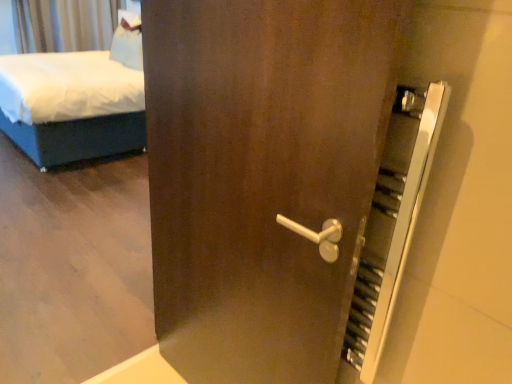
Question: Does silky gray curtain at upper left have a greater width compared to white fabric bed at left?

Choices:
 (A) yes
 (B) no

Answer: (B)

Question: Can you confirm if silky gray curtain at upper left is bigger than white fabric bed at left?

Choices:
 (A) yes
 (B) no

Answer: (B)

Question: Is the position of silky gray curtain at upper left less distant than that of white fabric bed at left?

Choices:
 (A) no
 (B) yes

Answer: (A)

Question: Is silky gray curtain at upper left at the left side of white fabric bed at left?

Choices:
 (A) yes
 (B) no

Answer: (A)

Question: Considering the relative sizes of silky gray curtain at upper left and white fabric bed at left in the image provided, is silky gray curtain at upper left thinner than white fabric bed at left?

Choices:
 (A) yes
 (B) no

Answer: (A)

Question: Is silky gray curtain at upper left positioned behind white fabric bed at left?

Choices:
 (A) no
 (B) yes

Answer: (B)

Question: Does white fabric bed at left have a smaller size compared to silky gray curtain at upper left?

Choices:
 (A) yes
 (B) no

Answer: (B)

Question: From a real-world perspective, is white fabric bed at left physically below silky gray curtain at upper left?

Choices:
 (A) no
 (B) yes

Answer: (B)

Question: Is white fabric bed at left taller than silky gray curtain at upper left?

Choices:
 (A) no
 (B) yes

Answer: (B)

Question: Is silky gray curtain at upper left located within white fabric bed at left?

Choices:
 (A) no
 (B) yes

Answer: (A)

Question: Is white fabric bed at left aimed at silky gray curtain at upper left?

Choices:
 (A) no
 (B) yes

Answer: (A)

Question: Considering the relative sizes of white fabric bed at left and silky gray curtain at upper left in the image provided, is white fabric bed at left bigger than silky gray curtain at upper left?

Choices:
 (A) yes
 (B) no

Answer: (A)

Question: From a real-world perspective, is silky gray curtain at upper left above or below white fabric bed at left?

Choices:
 (A) below
 (B) above

Answer: (B)